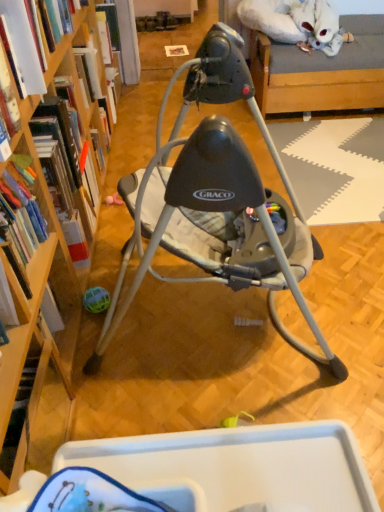
Question: Considering the relative sizes of hardcover book at upper left, the fourth book from the bottom, and hardcover book at left, arranged as the third book when viewed from the front, in the image provided, is hardcover book at upper left, the fourth book from the bottom, taller than hardcover book at left, arranged as the third book when viewed from the front,?

Choices:
 (A) yes
 (B) no

Answer: (B)

Question: Is hardcover book at upper left, the first book when ordered from top to bottom, positioned in front of hardcover book at left, positioned as the 2th book in back-to-front order?

Choices:
 (A) no
 (B) yes

Answer: (A)

Question: Does hardcover book at upper left, the fourth book from the bottom, have a smaller size compared to hardcover book at left, arranged as the 2th book when ordered from the bottom?

Choices:
 (A) no
 (B) yes

Answer: (B)

Question: From the image's perspective, would you say hardcover book at upper left, which ranks as the fourth book in front-to-back order, is shown under hardcover book at left, which appears as the 3th book when viewed from the top?

Choices:
 (A) no
 (B) yes

Answer: (A)

Question: Are hardcover book at upper left, which ranks as the fourth book in front-to-back order, and hardcover book at left, arranged as the 2th book when ordered from the bottom, far apart?

Choices:
 (A) no
 (B) yes

Answer: (B)

Question: From the image's perspective, does hardcover book at upper left, which is the 1th book from back to front, appear higher than hardcover book at left, arranged as the third book when viewed from the front?

Choices:
 (A) no
 (B) yes

Answer: (B)

Question: Considering the relative sizes of hardcover book at left, which appears as the 3th book when viewed from the top, and hardcover book at left, the 3th book positioned from the back, in the image provided, is hardcover book at left, which appears as the 3th book when viewed from the top, thinner than hardcover book at left, the 3th book positioned from the back,?

Choices:
 (A) no
 (B) yes

Answer: (A)

Question: From a real-world perspective, is hardcover book at left, positioned as the 2th book in back-to-front order, below hardcover book at left, which is the second book in top-to-bottom order?

Choices:
 (A) yes
 (B) no

Answer: (A)

Question: From a real-world perspective, is hardcover book at left, arranged as the third book when viewed from the front, physically above hardcover book at left, which is the 2th book in front-to-back order?

Choices:
 (A) yes
 (B) no

Answer: (B)

Question: Is hardcover book at left, which is the second book in top-to-bottom order, inside hardcover book at left, arranged as the third book when viewed from the front?

Choices:
 (A) no
 (B) yes

Answer: (A)

Question: Is there a large distance between hardcover book at left, arranged as the 2th book when ordered from the bottom, and hardcover book at left, the 3th book positioned from the back?

Choices:
 (A) no
 (B) yes

Answer: (A)

Question: Is hardcover book at left, arranged as the third book when viewed from the front, taller than hardcover book at left, which appears as the 3th book when ordered from the bottom?

Choices:
 (A) yes
 (B) no

Answer: (A)

Question: Can you confirm if hardcover book at upper left, which ranks as the fourth book in front-to-back order, is smaller than matte gray baby swing at center?

Choices:
 (A) no
 (B) yes

Answer: (B)